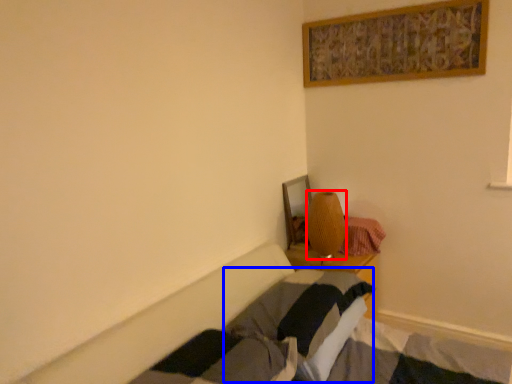
Question: Among these objects, which one is nearest to the camera, lamp (highlighted by a red box) or pillow (highlighted by a blue box)?

Choices:
 (A) lamp
 (B) pillow

Answer: (B)